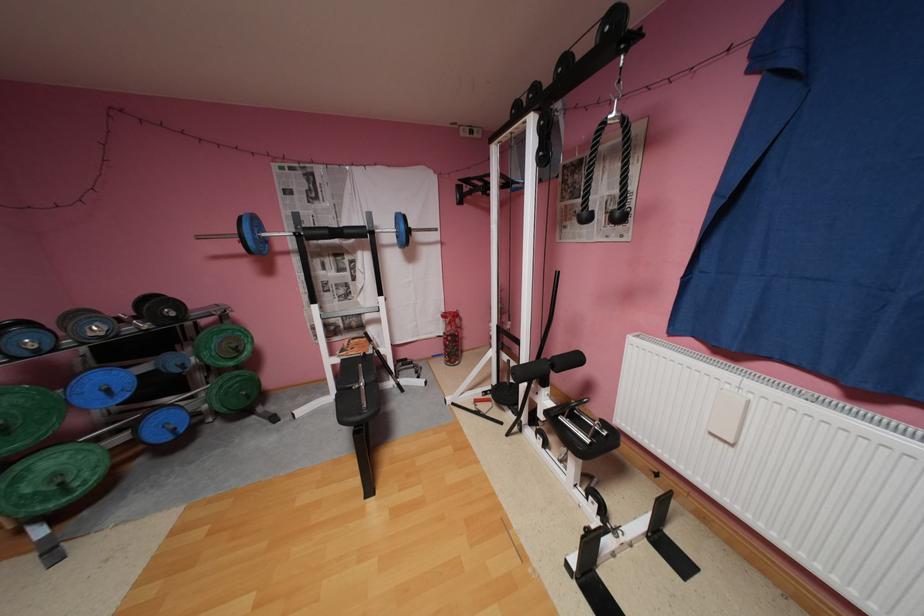
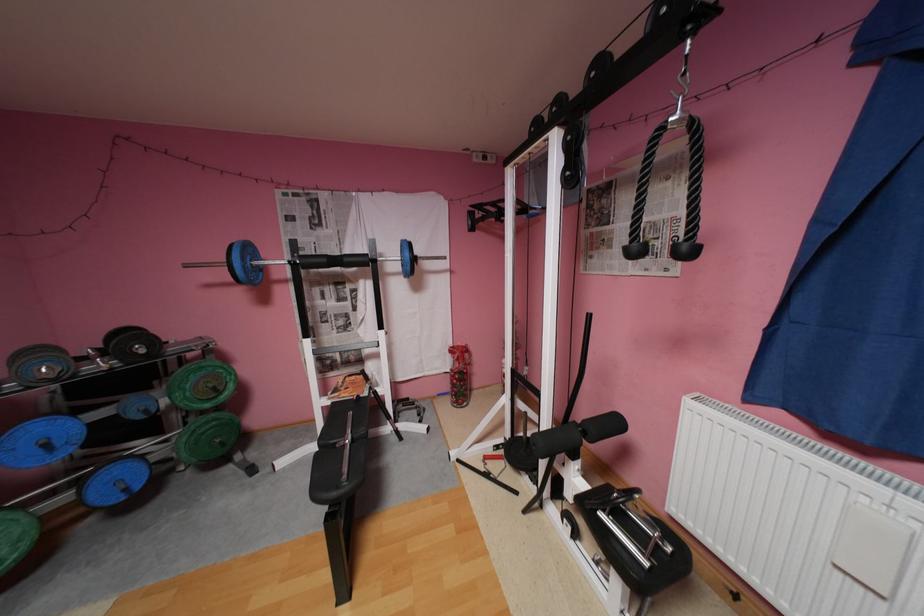
Where in the second image is the point corresponding to pixel 342 365 from the first image?

(333, 408)